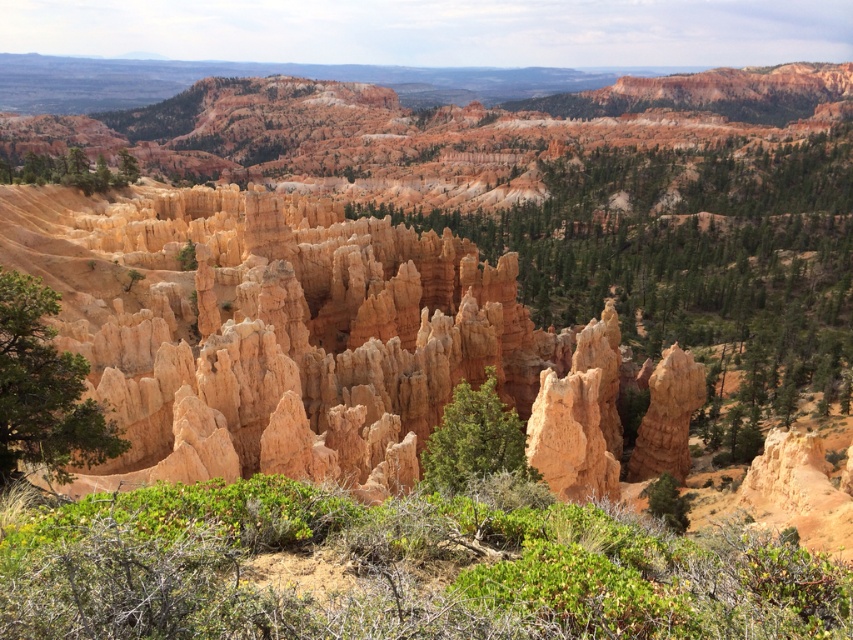
You are standing in the desert and see the green textured tree at center and the green leafy tree at upper left. Which tree is positioned more to the east if the image is oriented with north at the top?

The green leafy tree at upper left is positioned more to the east because it is located to the left of the green textured tree at center, and since north is at the top, left corresponds to west. Wait, no, actually in standard map orientation, north is top, so left would be west and right would be east. Therefore, since the green textured tree is to the right of the green leafy tree, the leafy tree is to the west of the textured tree. Therefore, the textured tree is more to the east. Hmm, I need to clarify.